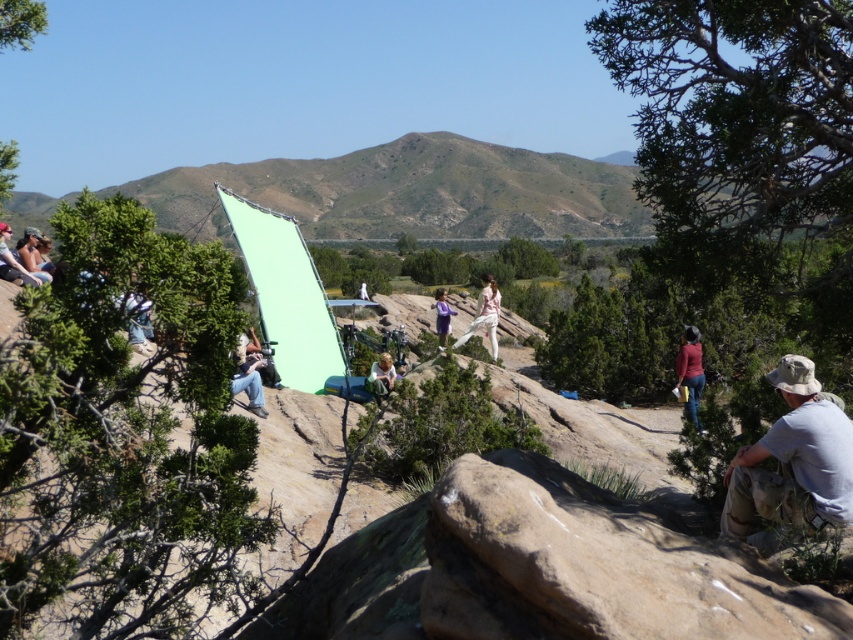
Question: Among these objects, which one is farthest from the camera?

Choices:
 (A) denim pants at left
 (B) light brown fabric bag at center

Answer: (B)

Question: Where is light green fabric tent at center located in relation to blue jeans at lower left in the image?

Choices:
 (A) right
 (B) left

Answer: (B)

Question: Among these objects, which one is farthest from the camera?

Choices:
 (A) purple fabric at center
 (B) light brown fabric bag at center
 (C) dark red sweater at center
 (D) green fabric tent at center

Answer: (A)

Question: Does green fabric tent at center have a smaller size compared to light brown fabric bag at center?

Choices:
 (A) yes
 (B) no

Answer: (B)

Question: Is green fabric tent at center smaller than matte black jacket at upper left?

Choices:
 (A) yes
 (B) no

Answer: (B)

Question: Considering the real-world distances, which object is closest to the denim pants at left?

Choices:
 (A) smooth brown rock at lower right
 (B) gray fabric hat at lower right

Answer: (A)